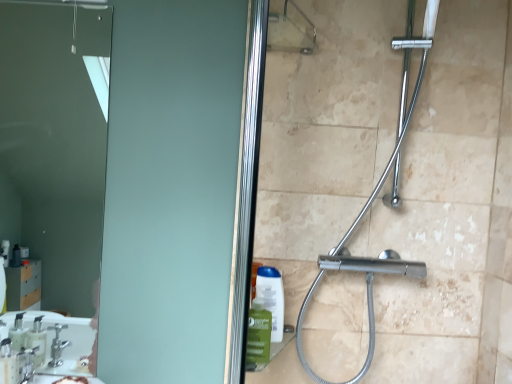
Question: Is translucent plastic soap dispenser at lower left shorter than chrome metallic shower at center?

Choices:
 (A) yes
 (B) no

Answer: (A)

Question: Is translucent plastic soap dispenser at lower left at the right side of chrome metallic shower at center?

Choices:
 (A) no
 (B) yes

Answer: (A)

Question: From the image's perspective, is translucent plastic soap dispenser at lower left over chrome metallic shower at center?

Choices:
 (A) yes
 (B) no

Answer: (B)

Question: From a real-world perspective, is translucent plastic soap dispenser at lower left over chrome metallic shower at center?

Choices:
 (A) yes
 (B) no

Answer: (B)

Question: Considering the relative sizes of translucent plastic soap dispenser at lower left and chrome metallic shower at center in the image provided, is translucent plastic soap dispenser at lower left bigger than chrome metallic shower at center?

Choices:
 (A) no
 (B) yes

Answer: (A)

Question: Based on their sizes in the image, would you say matte glass mirror at upper left is bigger or smaller than chrome metallic shower at center?

Choices:
 (A) big
 (B) small

Answer: (B)

Question: From the image's perspective, is matte glass mirror at upper left positioned above or below chrome metallic shower at center?

Choices:
 (A) above
 (B) below

Answer: (A)

Question: Considering the positions of matte glass mirror at upper left and chrome metallic shower at center in the image, is matte glass mirror at upper left wider or thinner than chrome metallic shower at center?

Choices:
 (A) thin
 (B) wide

Answer: (A)

Question: Is matte glass mirror at upper left taller or shorter than chrome metallic shower at center?

Choices:
 (A) tall
 (B) short

Answer: (B)

Question: Considering the positions of chrome metallic shower at center and matte glass mirror at upper left in the image, is chrome metallic shower at center taller or shorter than matte glass mirror at upper left?

Choices:
 (A) short
 (B) tall

Answer: (B)

Question: Considering the positions of point (313, 286) and point (51, 9), is point (313, 286) closer or farther from the camera than point (51, 9)?

Choices:
 (A) closer
 (B) farther

Answer: (A)

Question: Is chrome metallic shower at center in front of or behind matte glass mirror at upper left in the image?

Choices:
 (A) front
 (B) behind

Answer: (A)

Question: From the image's perspective, is chrome metallic shower at center positioned above or below matte glass mirror at upper left?

Choices:
 (A) below
 (B) above

Answer: (A)

Question: From their relative heights in the image, would you say translucent plastic soap dispenser at lower left is taller or shorter than chrome metallic shower at center?

Choices:
 (A) short
 (B) tall

Answer: (A)

Question: Looking at the image, does translucent plastic soap dispenser at lower left seem bigger or smaller compared to chrome metallic shower at center?

Choices:
 (A) small
 (B) big

Answer: (A)